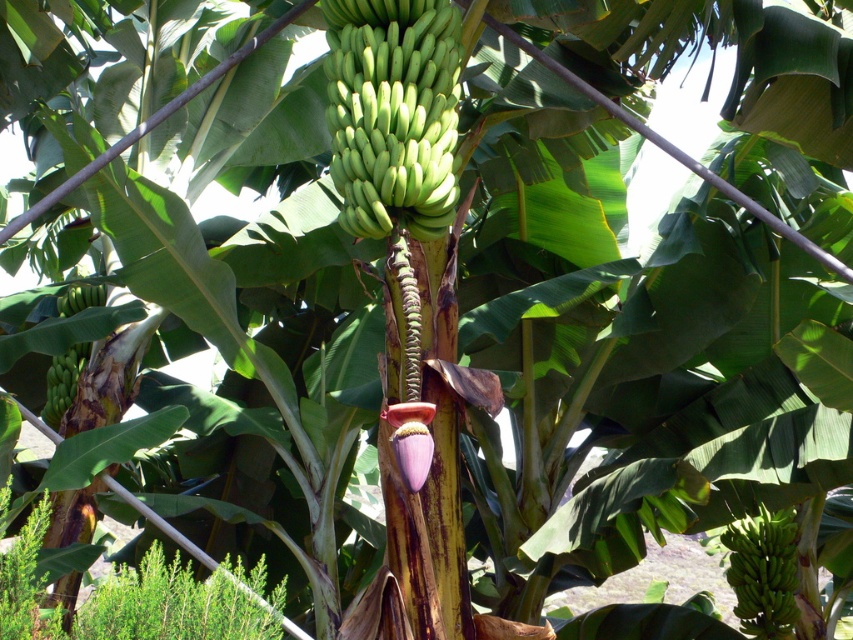
Question: Estimate the real-world distances between objects in this image. Which object is closer to the green matte bananas at center?

Choices:
 (A) green matte bananas at lower right
 (B) green matte bananas at left

Answer: (B)

Question: Can you confirm if green matte bananas at lower right is positioned to the right of green matte bananas at left?

Choices:
 (A) no
 (B) yes

Answer: (B)

Question: Which object appears closest to the camera in this image?

Choices:
 (A) green matte bananas at lower right
 (B) green matte bananas at left
 (C) green matte bananas at center

Answer: (C)

Question: Which of the following is the closest to the observer?

Choices:
 (A) (749, 604)
 (B) (329, 44)
 (C) (80, 344)

Answer: (B)

Question: Considering the relative positions of green matte bananas at lower right and green matte bananas at left in the image provided, where is green matte bananas at lower right located with respect to green matte bananas at left?

Choices:
 (A) below
 (B) above

Answer: (A)

Question: Where is green matte bananas at center located in relation to green matte bananas at lower right in the image?

Choices:
 (A) above
 (B) below

Answer: (A)